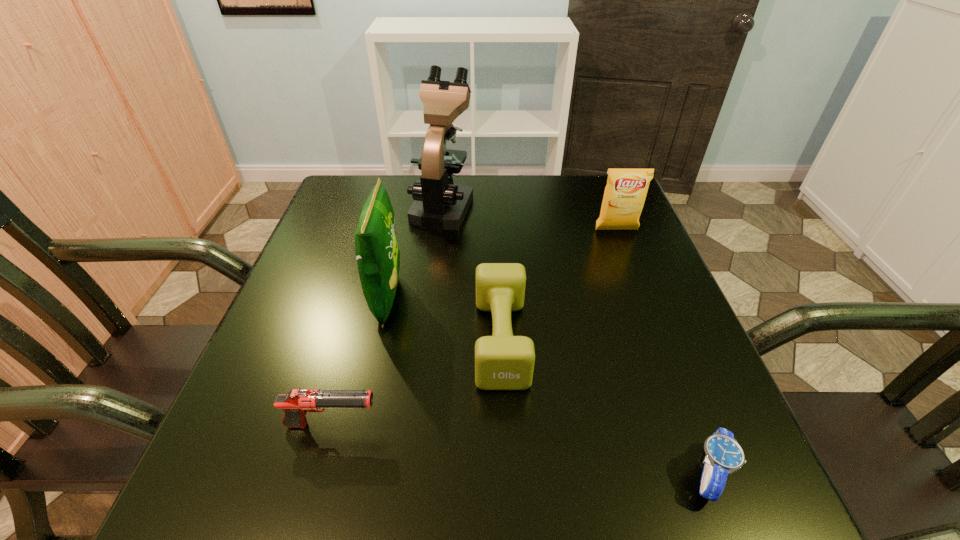
Where is `object situated at the near right corner`? This screenshot has height=540, width=960. object situated at the near right corner is located at coordinates (724, 455).

At what (x,y) coordinates should I click in order to perform the action: click on free spot at the far edge of the desktop. Please return your answer as a coordinate pair (x, y). Looking at the image, I should click on (502, 203).

The height and width of the screenshot is (540, 960). In the image, there is a desktop. Identify the location of vacant space at the near edge. (395, 462).

This screenshot has width=960, height=540. I want to click on vacant space at the left edge of the desktop, so click(x=308, y=359).

Locate an element on the screen. Image resolution: width=960 pixels, height=540 pixels. vacant point at the right edge is located at coordinates (588, 240).

Where is `vacant space at the far left corner of the desktop`? vacant space at the far left corner of the desktop is located at coordinates click(x=393, y=177).

Locate an element on the screen. free space at the near left corner of the desktop is located at coordinates (200, 469).

This screenshot has height=540, width=960. Find the location of `vacant space at the far right corner of the desktop`. vacant space at the far right corner of the desktop is located at coordinates (596, 220).

Where is `vacant space at the near right corner of the desktop`? vacant space at the near right corner of the desktop is located at coordinates (645, 463).

You are a GUI agent. You are given a task and a screenshot of the screen. Output one action in this format:
    pyautogui.click(x=<x>, y=<y>)
    Task: Click on the free area in between the farther crisp (potato chip) and the tallest object
    This screenshot has width=960, height=540.
    Given the screenshot: What is the action you would take?
    pyautogui.click(x=530, y=217)